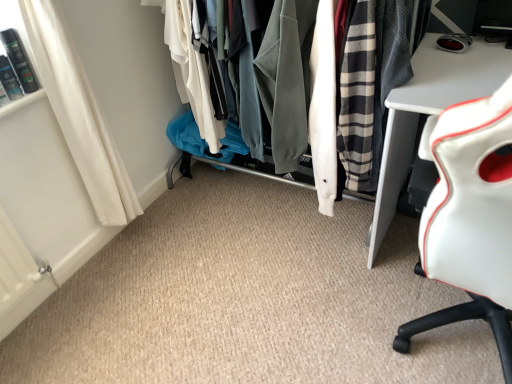
Question: Is textured fabric clothes at center completely or partially outside of white fabric curtain at lower left?

Choices:
 (A) no
 (B) yes

Answer: (B)

Question: Does textured fabric clothes at center come in front of white fabric curtain at lower left?

Choices:
 (A) yes
 (B) no

Answer: (B)

Question: Is textured fabric clothes at center at the left side of white fabric curtain at lower left?

Choices:
 (A) yes
 (B) no

Answer: (B)

Question: Can you confirm if textured fabric clothes at center is bigger than white fabric curtain at lower left?

Choices:
 (A) yes
 (B) no

Answer: (A)

Question: From a real-world perspective, is textured fabric clothes at center physically below white fabric curtain at lower left?

Choices:
 (A) yes
 (B) no

Answer: (A)

Question: Considering the relative sizes of textured fabric clothes at center and white fabric curtain at lower left in the image provided, is textured fabric clothes at center thinner than white fabric curtain at lower left?

Choices:
 (A) yes
 (B) no

Answer: (B)

Question: Is textured fabric clothes at center located within white leather chair at right?

Choices:
 (A) no
 (B) yes

Answer: (A)

Question: From a real-world perspective, is white leather chair at right positioned under textured fabric clothes at center based on gravity?

Choices:
 (A) no
 (B) yes

Answer: (A)

Question: Considering the relative sizes of white leather chair at right and textured fabric clothes at center in the image provided, is white leather chair at right shorter than textured fabric clothes at center?

Choices:
 (A) yes
 (B) no

Answer: (B)

Question: Is white leather chair at right not near textured fabric clothes at center?

Choices:
 (A) no
 (B) yes

Answer: (A)

Question: Is white leather chair at right positioned beyond the bounds of textured fabric clothes at center?

Choices:
 (A) no
 (B) yes

Answer: (B)

Question: Does white leather chair at right turn towards textured fabric clothes at center?

Choices:
 (A) no
 (B) yes

Answer: (A)

Question: Is textured fabric clothes at center oriented towards white leather chair at right?

Choices:
 (A) yes
 (B) no

Answer: (B)